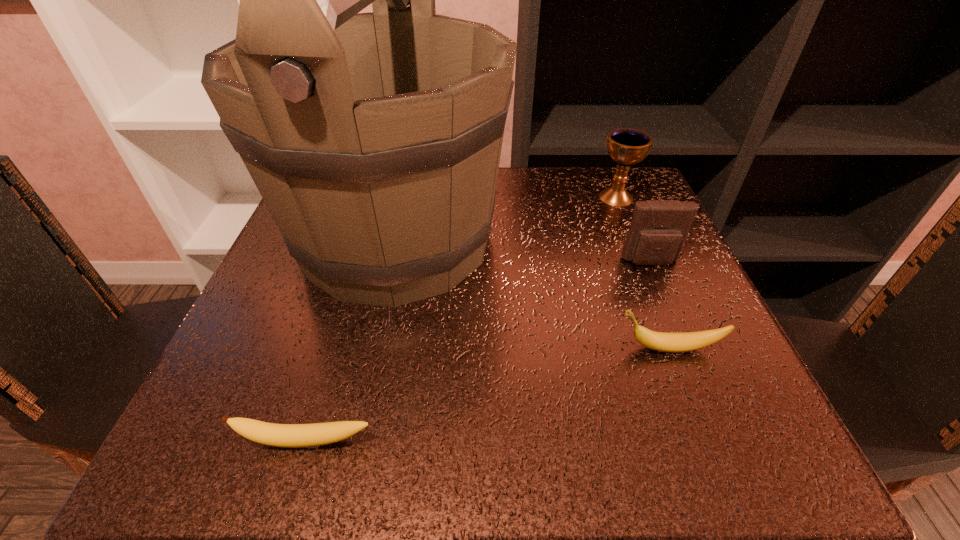
You are a GUI agent. You are given a task and a screenshot of the screen. Output one action in this format:
    pyautogui.click(x=<x>, y=<y>)
    Task: Click on the vacant area that satisfies the following two spatial constraints: 1. with an open flap on the pouch; 2. at the stem of the right banana
    The image size is (960, 540).
    Given the screenshot: What is the action you would take?
    pyautogui.click(x=687, y=348)

Find the location of `vacant space that satisfies the following two spatial constraints: 1. with an open flap on the pouch; 2. at the stem of the fourth farthest object`. vacant space that satisfies the following two spatial constraints: 1. with an open flap on the pouch; 2. at the stem of the fourth farthest object is located at coordinates (687, 348).